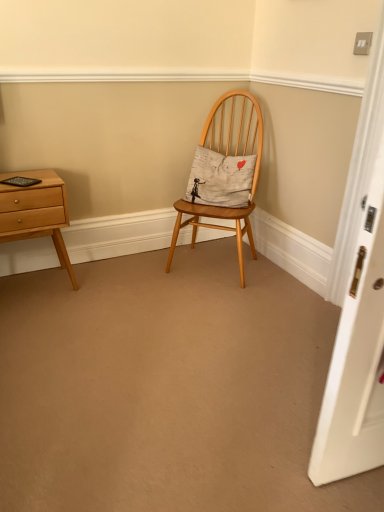
Question: Does white cotton cushion at center appear on the right side of light brown wood nightstand at left?

Choices:
 (A) no
 (B) yes

Answer: (B)

Question: From the image's perspective, is white cotton cushion at center located beneath light brown wood nightstand at left?

Choices:
 (A) no
 (B) yes

Answer: (A)

Question: Can you confirm if white cotton cushion at center is positioned to the left of light brown wood nightstand at left?

Choices:
 (A) yes
 (B) no

Answer: (B)

Question: From the image's perspective, is white cotton cushion at center located above light brown wood nightstand at left?

Choices:
 (A) no
 (B) yes

Answer: (B)

Question: Is white cotton cushion at center further to camera compared to light brown wood nightstand at left?

Choices:
 (A) no
 (B) yes

Answer: (B)

Question: Can you confirm if white cotton cushion at center is bigger than light brown wood nightstand at left?

Choices:
 (A) no
 (B) yes

Answer: (A)

Question: Is light brown wood nightstand at left not inside natural wood chair at center?

Choices:
 (A) no
 (B) yes

Answer: (B)

Question: Is light brown wood nightstand at left positioned far away from natural wood chair at center?

Choices:
 (A) no
 (B) yes

Answer: (A)

Question: Are light brown wood nightstand at left and natural wood chair at center making contact?

Choices:
 (A) yes
 (B) no

Answer: (B)

Question: Considering the relative sizes of light brown wood nightstand at left and natural wood chair at center in the image provided, is light brown wood nightstand at left wider than natural wood chair at center?

Choices:
 (A) yes
 (B) no

Answer: (B)

Question: Could you tell me if light brown wood nightstand at left is turned towards natural wood chair at center?

Choices:
 (A) yes
 (B) no

Answer: (B)

Question: Could natural wood chair at center be considered to be inside light brown wood nightstand at left?

Choices:
 (A) no
 (B) yes

Answer: (A)

Question: Considering the relative sizes of natural wood chair at center and white cotton cushion at center in the image provided, is natural wood chair at center shorter than white cotton cushion at center?

Choices:
 (A) no
 (B) yes

Answer: (A)